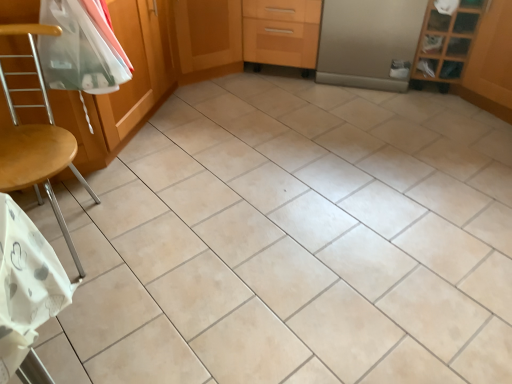
Question: Is point (15, 165) closer or farther from the camera than point (234, 16)?

Choices:
 (A) farther
 (B) closer

Answer: (B)

Question: Based on their positions, is wooden at left located to the left or right of wooden cabinet at center, which is the 2th screen door from right to left?

Choices:
 (A) right
 (B) left

Answer: (B)

Question: Based on their relative distances, which object is nearer to the wooden shelf at upper right?

Choices:
 (A) wooden drawer at center
 (B) satin silver refrigerator at center, which appears as the 2th screen door when viewed from the left
 (C) wooden at left
 (D) clear plastic bag at upper left
 (E) wooden cabinet at center, which is the 1th screen door from left to right

Answer: (B)

Question: Which of these objects is positioned closest to the wooden drawer at center?

Choices:
 (A) clear plastic bag at upper left
 (B) wooden at left
 (C) wooden shelf at upper right
 (D) satin silver refrigerator at center, which appears as the 2th screen door when viewed from the left
 (E) wooden cabinet at center, which is the 2th screen door from right to left

Answer: (E)